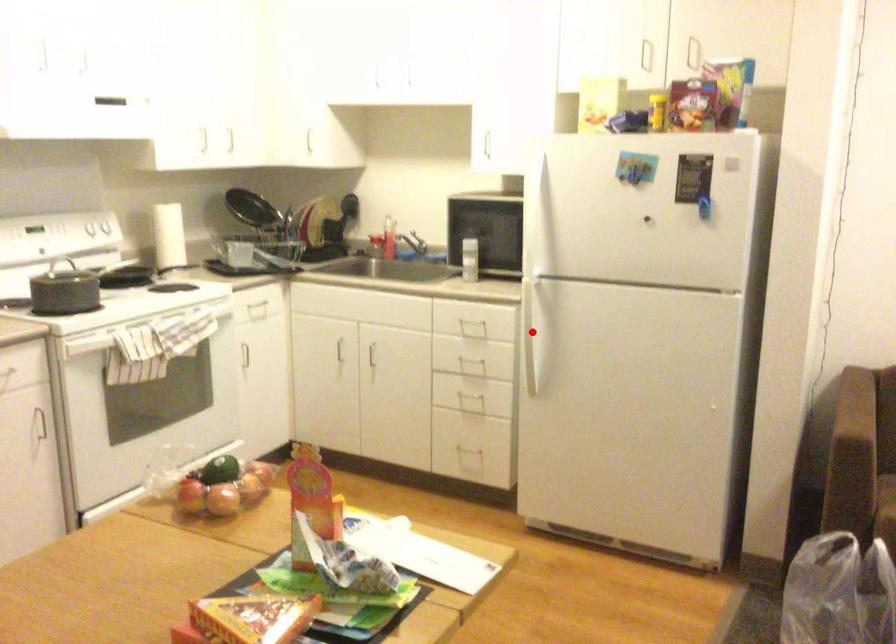
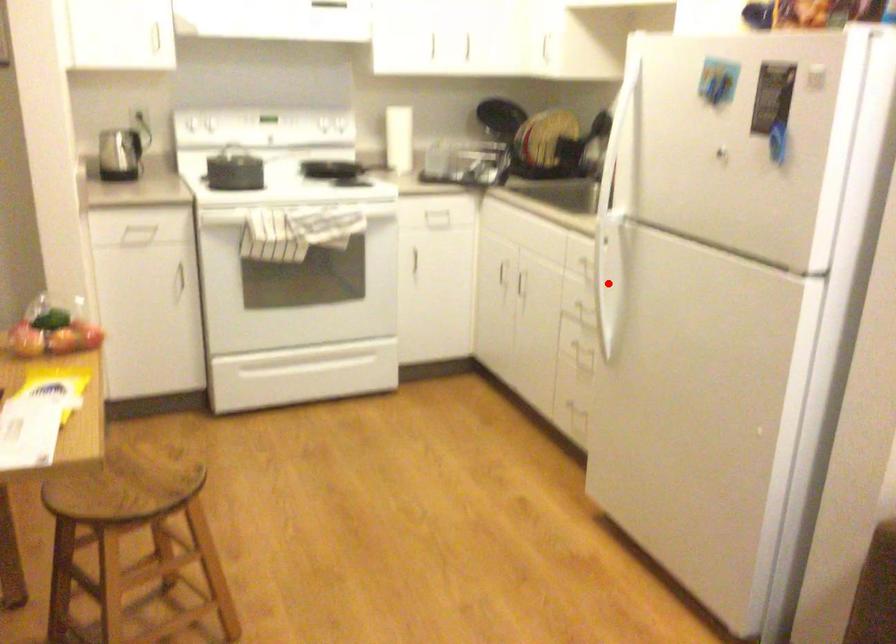
I am providing you with two images of the same scene from different viewpoints. A red point is marked on the first image and another point is marked on the second image. Do the highlighted points in image1 and image2 indicate the same real-world spot?

Yes